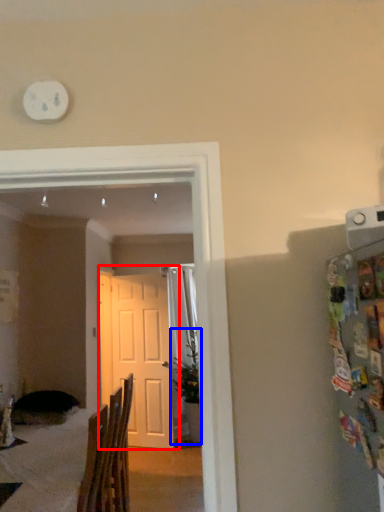
Question: Which object is closer to the camera taking this photo, door (highlighted by a red box) or houseplant (highlighted by a blue box)?

Choices:
 (A) door
 (B) houseplant

Answer: (A)